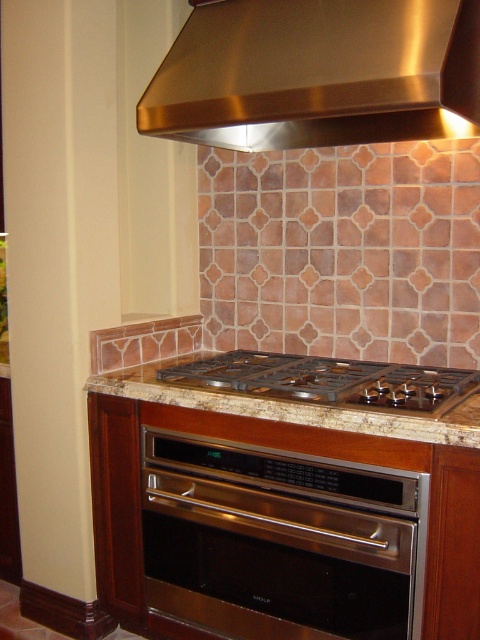
Is stainless steel oven at center wider than stainless steel exhaust hood at upper center?

No, stainless steel oven at center is not wider than stainless steel exhaust hood at upper center.

Based on the photo, is the position of stainless steel oven at center more distant than that of stainless steel exhaust hood at upper center?

Yes, it is.

This screenshot has width=480, height=640. What are the coordinates of `stainless steel oven at center` in the screenshot? It's located at (280, 541).

At what (x,y) coordinates should I click in order to perform the action: click on stainless steel oven at center. Please return your answer as a coordinate pair (x, y). This screenshot has height=640, width=480. Looking at the image, I should click on (280, 541).

Between stainless steel oven at center and marble/granite countertop at center, which one has less height?

Standing shorter between the two is marble/granite countertop at center.

Is point (255, 468) closer to camera compared to point (249, 372)?

Yes, point (255, 468) is in front of point (249, 372).

Locate an element on the screen. The image size is (480, 640). stainless steel oven at center is located at coordinates (280, 541).

Who is more distant from viewer, (208,17) or (439,403)?

Point (208,17)

Who is taller, stainless steel exhaust hood at upper center or marble/granite countertop at center?

stainless steel exhaust hood at upper center is taller.

Describe the element at coordinates (317, 74) in the screenshot. This screenshot has width=480, height=640. I see `stainless steel exhaust hood at upper center` at that location.

You are a GUI agent. You are given a task and a screenshot of the screen. Output one action in this format:
    pyautogui.click(x=<x>, y=<y>)
    Task: Click on the stainless steel exhaust hood at upper center
    Image resolution: width=480 pixels, height=640 pixels.
    Given the screenshot: What is the action you would take?
    pyautogui.click(x=317, y=74)